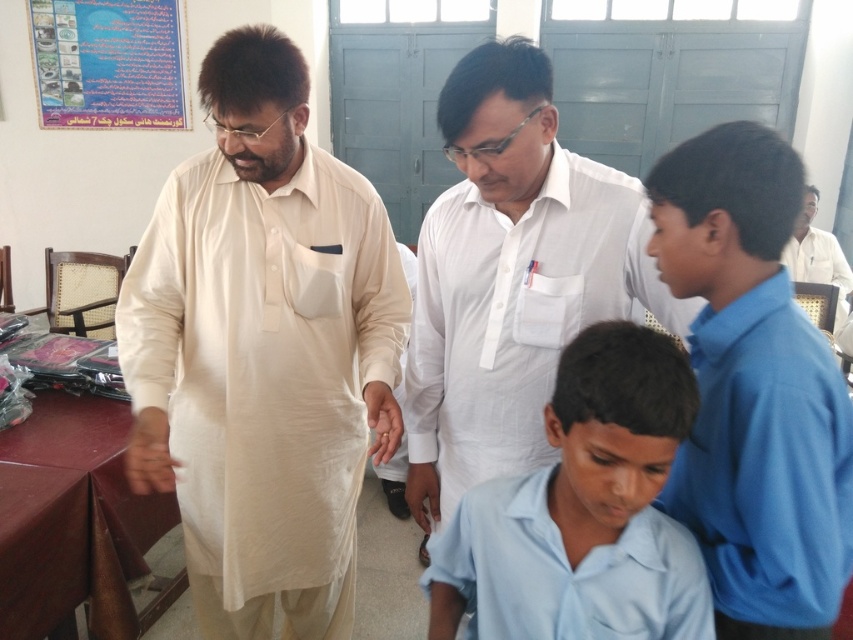
Question: Among these points, which one is farthest from the camera?

Choices:
 (A) (287, 621)
 (B) (486, 72)
 (C) (102, 36)
 (D) (743, 536)

Answer: (C)

Question: Is blue cotton shirt at right smaller than white cotton shirt at upper right?

Choices:
 (A) yes
 (B) no

Answer: (A)

Question: Where is white cotton shirt at center located in relation to blue cotton shirt at right in the image?

Choices:
 (A) above
 (B) below

Answer: (A)

Question: Is white cotton shirt at center to the left of light blue cotton shirt at lower center from the viewer's perspective?

Choices:
 (A) yes
 (B) no

Answer: (A)

Question: Which of these objects is positioned closest to the blue cotton shirt at right?

Choices:
 (A) blue paperboard at upper left
 (B) light blue cotton shirt at lower center

Answer: (B)

Question: Which object appears farthest from the camera in this image?

Choices:
 (A) white cotton shirt at center
 (B) beige cotton kurta at center
 (C) light blue cotton shirt at lower center
 (D) blue cotton shirt at right

Answer: (B)